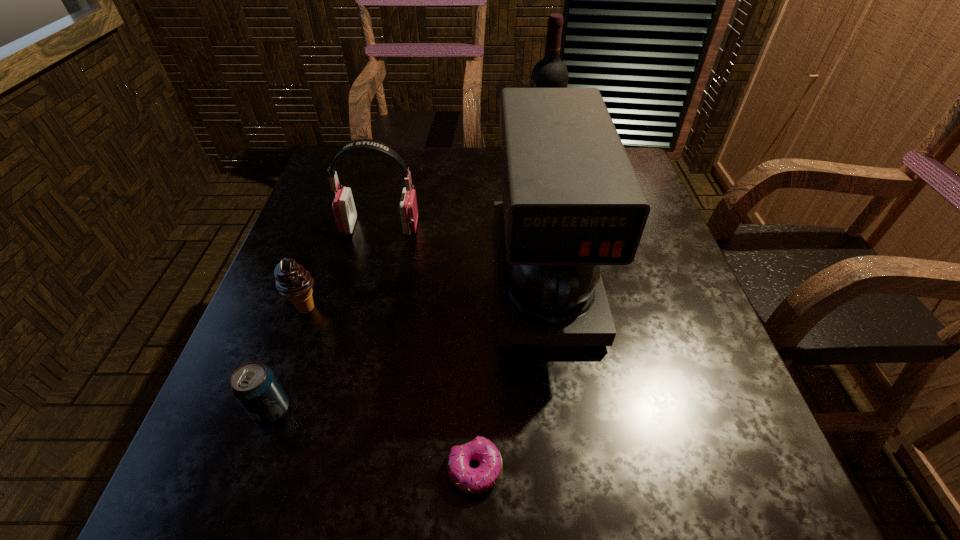
Identify the location of pop soda located at the left edge. (254, 385).

In the image, there is a desktop. Find the location of `free space at the far edge`. free space at the far edge is located at coordinates (483, 172).

The height and width of the screenshot is (540, 960). In the image, there is a desktop. Identify the location of free space at the near edge. (440, 472).

Find the location of a particular element. The image size is (960, 540). free space at the left edge of the desktop is located at coordinates (231, 422).

Locate an element on the screen. This screenshot has width=960, height=540. free region at the right edge of the desktop is located at coordinates (646, 338).

Locate an element on the screen. vacant point at the near left corner is located at coordinates (191, 502).

At what (x,y) coordinates should I click in order to perform the action: click on unoccupied area between the nearest object and the icecream. Please return your answer as a coordinate pair (x, y). The image size is (960, 540). Looking at the image, I should click on (390, 389).

I want to click on blank region between the third tallest object and the third object from right to left, so click(427, 348).

I want to click on empty space between the fifth tallest object and the third tallest object, so click(326, 319).

Find the location of `free space between the shortest object and the third tallest object`. free space between the shortest object and the third tallest object is located at coordinates (427, 348).